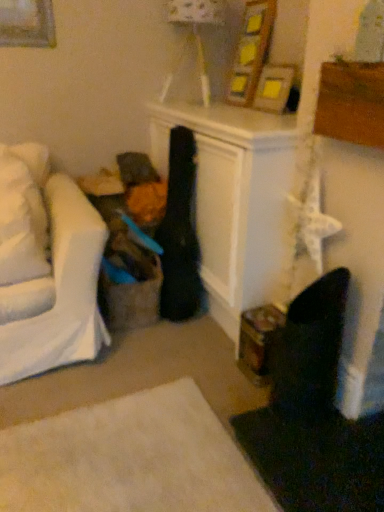
You are a GUI agent. You are given a task and a screenshot of the screen. Output one action in this format:
    pyautogui.click(x=<x>, y=<y>)
    Task: Click on the wooden picture frame at upper center
    This screenshot has width=384, height=512.
    Given the screenshot: What is the action you would take?
    pyautogui.click(x=273, y=88)

Measure the distance between white soft pillow at left and camera.

The depth of white soft pillow at left is 1.54 meters.

Where is `matte white lampshade at upper center`? matte white lampshade at upper center is located at coordinates (193, 37).

I want to click on wooden picture frame at upper center, so click(273, 88).

Consider the image. Is matte white lampshade at upper center further to camera compared to white soft pillow at left?

Yes, the depth of matte white lampshade at upper center is greater than that of white soft pillow at left.

From the picture: From a real-world perspective, is matte white lampshade at upper center on top of white soft pillow at left?

Yes, from a real-world perspective, matte white lampshade at upper center is on top of white soft pillow at left.

In terms of height, does matte white lampshade at upper center look taller or shorter compared to white soft pillow at left?

In the image, matte white lampshade at upper center appears to be taller than white soft pillow at left.

Can you tell me how much matte white lampshade at upper center and white soft pillow at left differ in facing direction?

They differ by 81.8 degrees in their facing directions.

Considering the relative sizes of wooden picture frame at upper center and white soft pillow at left in the image provided, is wooden picture frame at upper center wider than white soft pillow at left?

In fact, wooden picture frame at upper center might be narrower than white soft pillow at left.

How much distance is there between wooden picture frame at upper center and white soft pillow at left?

wooden picture frame at upper center is 1.18 meters away from white soft pillow at left.

Does wooden picture frame at upper center have a greater height compared to white soft pillow at left?

No, wooden picture frame at upper center is not taller than white soft pillow at left.

Would you consider wooden picture frame at upper center to be distant from white soft pillow at left?

wooden picture frame at upper center is far away from white soft pillow at left.

Is point (7, 284) positioned after point (179, 48)?

That is False.

Is white soft pillow at left to the right of matte white lampshade at upper center from the viewer's perspective?

No.

From a real-world perspective, is white soft pillow at left positioned above or below matte white lampshade at upper center?

white soft pillow at left is below matte white lampshade at upper center.

Could you tell me if matte white lampshade at upper center is facing wooden picture frame at upper center?

No, matte white lampshade at upper center is not turned towards wooden picture frame at upper center.

Is point (173, 65) closer or farther from the camera than point (275, 65)?

Point (173, 65) is positioned farther from the camera compared to point (275, 65).

From a real-world perspective, relative to wooden picture frame at upper center, is matte white lampshade at upper center vertically above or below?

matte white lampshade at upper center is situated higher than wooden picture frame at upper center in the real world.

Is white soft pillow at left facing away from wooden picture frame at upper center?

That's not correct — white soft pillow at left is not looking away from wooden picture frame at upper center.

Which object is positioned more to the right, white soft pillow at left or wooden picture frame at upper center?

From the viewer's perspective, wooden picture frame at upper center appears more on the right side.

The image size is (384, 512). In order to click on pillow on the left of wooden picture frame at upper center in this screenshot , I will do `click(21, 224)`.

Which is correct: white soft pillow at left is inside wooden picture frame at upper center, or outside of it?

white soft pillow at left lies outside wooden picture frame at upper center.

From the image's perspective, which one is positioned higher, wooden picture frame at upper center or matte white lampshade at upper center?

matte white lampshade at upper center is shown above in the image.

Identify the location of picture frame that appears on the right of matte white lampshade at upper center. (273, 88).

Consider the image. Considering the positions of objects wooden picture frame at upper center and matte white lampshade at upper center in the image provided, who is more to the left, wooden picture frame at upper center or matte white lampshade at upper center?

matte white lampshade at upper center.

Looking at this image, which is behind, wooden picture frame at upper center or matte white lampshade at upper center?

matte white lampshade at upper center is more distant.

Locate an element on the screen. The width and height of the screenshot is (384, 512). pillow below the matte white lampshade at upper center (from the image's perspective) is located at coordinates (21, 224).

I want to click on pillow that appears below the wooden picture frame at upper center (from a real-world perspective), so click(21, 224).

Considering their positions, is white soft pillow at left positioned closer to matte white lampshade at upper center than wooden picture frame at upper center?

wooden picture frame at upper center is positioned closer to the anchor matte white lampshade at upper center.

Looking at the image, which one is located closer to matte white lampshade at upper center, wooden picture frame at upper center or white soft pillow at left?

Among the two, wooden picture frame at upper center is located nearer to matte white lampshade at upper center.

Looking at the image, which one is located closer to white soft pillow at left, wooden picture frame at upper center or matte white lampshade at upper center?

matte white lampshade at upper center is positioned closer to the anchor white soft pillow at left.

Which object lies further to the anchor point white soft pillow at left, matte white lampshade at upper center or wooden picture frame at upper center?

wooden picture frame at upper center lies further to white soft pillow at left than the other object.

Based on their spatial positions, is white soft pillow at left or matte white lampshade at upper center further from wooden picture frame at upper center?

Based on the image, white soft pillow at left appears to be further to wooden picture frame at upper center.

Looking at the image, which one is located further to wooden picture frame at upper center, matte white lampshade at upper center or white soft pillow at left?

white soft pillow at left is further to wooden picture frame at upper center.

The image size is (384, 512). Identify the location of lamp between white soft pillow at left and wooden picture frame at upper center in the horizontal direction. (193, 37).